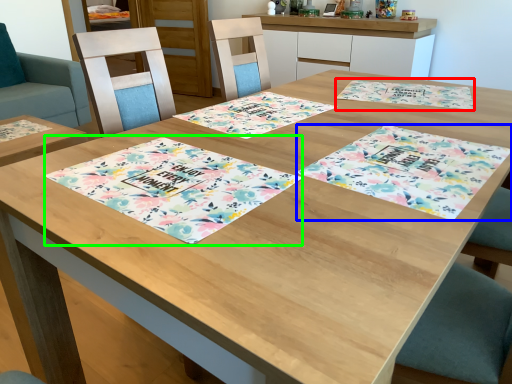
Question: Which object is positioned closest to place mat (highlighted by a red box)? Select from place mat (highlighted by a blue box) and place mat (highlighted by a green box).

Choices:
 (A) place mat
 (B) place mat

Answer: (A)